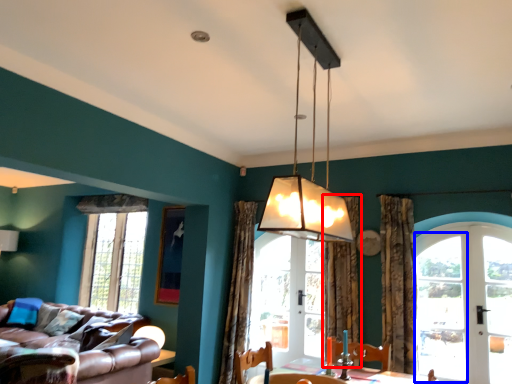
Question: Which object is closer to the camera taking this photo, curtain (highlighted by a red box) or glass door (highlighted by a blue box)?

Choices:
 (A) curtain
 (B) glass door

Answer: (B)